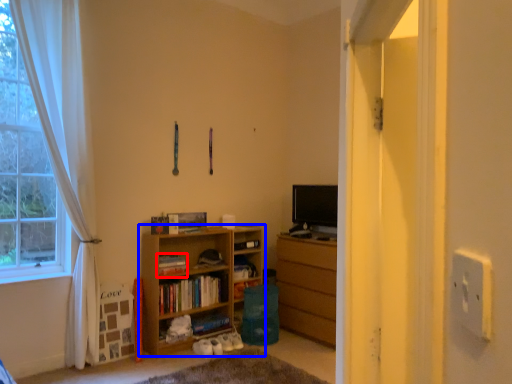
Question: Which point is further to the camera, book (highlighted by a red box) or bookcase (highlighted by a blue box)?

Choices:
 (A) book
 (B) bookcase

Answer: (A)